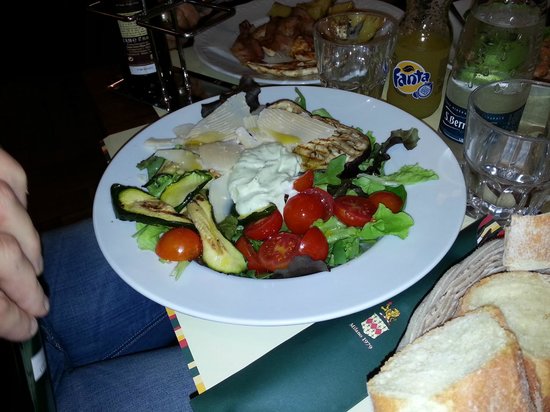
I want to click on water glass, so click(x=490, y=167).